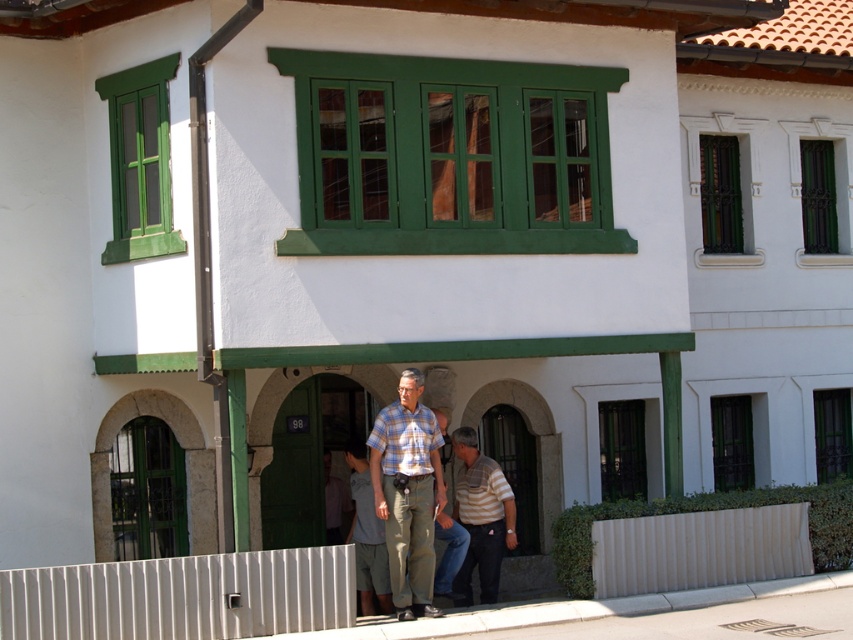
You are a passerby on the sidewalk in front of the building. You see two men wearing striped shirts. One has a striped cotton shirt at center and the other has a light blue striped shirt at center. Which one is standing to the right of the other?

The striped cotton shirt at center is positioned on the right side of light blue striped shirt at center, so the man wearing the striped cotton shirt at center is standing to the right of the man wearing the light blue striped shirt at center.